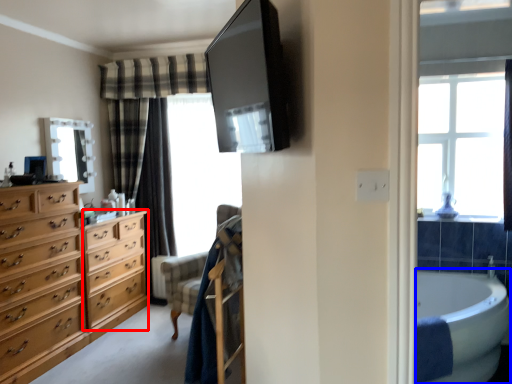
Question: Which object appears farthest to the camera in this image, cabinetry (highlighted by a red box) or bath (highlighted by a blue box)?

Choices:
 (A) cabinetry
 (B) bath

Answer: (A)